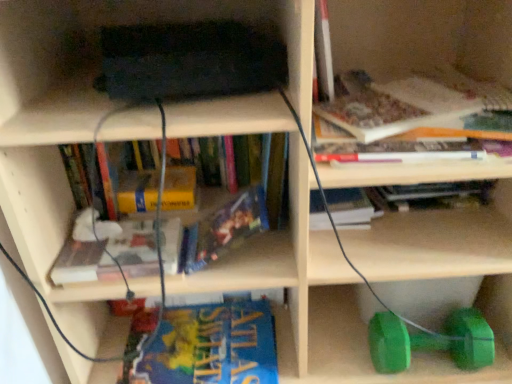
Question: Is hardcover book at upper right, which is the eighth book from bottom to top, positioned far away from hardcover book at upper center, the sixth book positioned from the bottom?

Choices:
 (A) no
 (B) yes

Answer: (A)

Question: Is hardcover book at upper right, which is the eighth book from bottom to top, turned away from hardcover book at upper center, the third book when ordered from top to bottom?

Choices:
 (A) no
 (B) yes

Answer: (A)

Question: Can hardcover book at upper center, the third book when ordered from top to bottom, be found inside hardcover book at upper right, which is the eighth book from bottom to top?

Choices:
 (A) no
 (B) yes

Answer: (A)

Question: Does hardcover book at upper right, which is the eighth book from bottom to top, have a greater width compared to hardcover book at upper center, the sixth book positioned from the bottom?

Choices:
 (A) yes
 (B) no

Answer: (A)

Question: Does hardcover book at upper right, acting as the first book starting from the top, come behind hardcover book at upper center, the third book when ordered from top to bottom?

Choices:
 (A) yes
 (B) no

Answer: (B)

Question: From a real-world perspective, is hardcover book at upper right, acting as the first book starting from the top, on hardcover book at upper center, the sixth book positioned from the bottom?

Choices:
 (A) no
 (B) yes

Answer: (B)

Question: Can you confirm if hardcover book at upper right, acting as the first book starting from the top, is taller than yellow paperback book at center, which ranks as the fourth book in top-to-bottom order?

Choices:
 (A) no
 (B) yes

Answer: (B)

Question: Is hardcover book at upper right, which is the eighth book from bottom to top, oriented away from yellow paperback book at center, which appears as the 5th book when ordered from the bottom?

Choices:
 (A) no
 (B) yes

Answer: (A)

Question: Can you see hardcover book at upper right, which is the eighth book from bottom to top, touching yellow paperback book at center, which appears as the 5th book when ordered from the bottom?

Choices:
 (A) no
 (B) yes

Answer: (A)

Question: From a real-world perspective, is hardcover book at upper right, which is the eighth book from bottom to top, under yellow paperback book at center, which ranks as the fourth book in top-to-bottom order?

Choices:
 (A) no
 (B) yes

Answer: (A)

Question: From the image's perspective, is hardcover book at upper right, acting as the first book starting from the top, below yellow paperback book at center, which appears as the 5th book when ordered from the bottom?

Choices:
 (A) no
 (B) yes

Answer: (A)

Question: Does hardcover book at upper right, acting as the first book starting from the top, turn towards yellow paperback book at center, which appears as the 5th book when ordered from the bottom?

Choices:
 (A) yes
 (B) no

Answer: (B)

Question: Is hardcover book at upper right, the 2th book when ordered from top to bottom, wider than green rubber dumbbell at lower right?

Choices:
 (A) no
 (B) yes

Answer: (B)